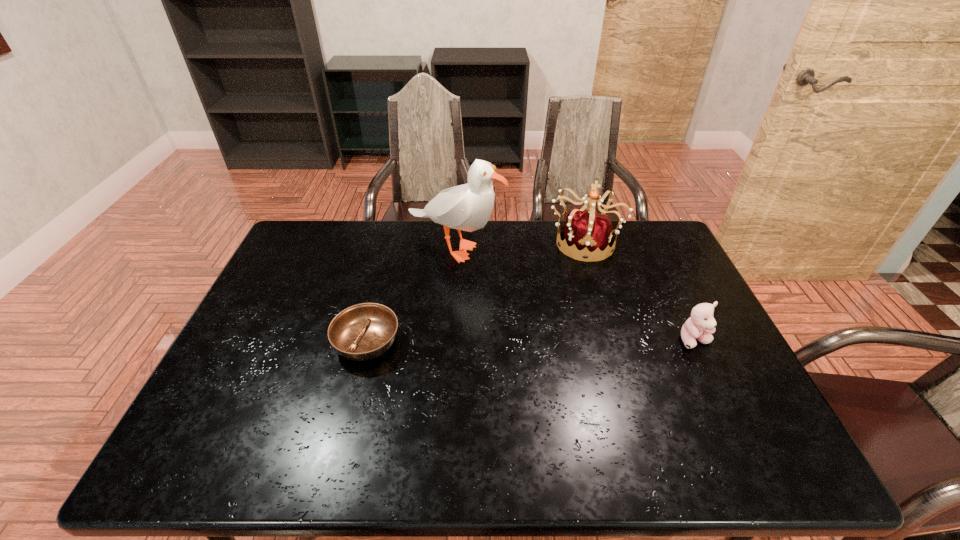
At what (x,y) coordinates should I click in order to perform the action: click on vacant space located at the beak of the tallest object. Please return your answer as a coordinate pair (x, y). Looking at the image, I should click on click(490, 289).

This screenshot has width=960, height=540. In order to click on blank area located 0.320m on the front-facing side of the third shortest object in this screenshot , I will do `click(574, 334)`.

This screenshot has width=960, height=540. Identify the location of blank space located 0.400m on the front-facing side of the third shortest object. [572, 357].

Where is `free location located on the front-facing side of the third shortest object`? The height and width of the screenshot is (540, 960). free location located on the front-facing side of the third shortest object is located at coordinates (574, 334).

Locate an element on the screen. gull at the far edge is located at coordinates (467, 207).

Find the location of a particular element. Image resolution: width=960 pixels, height=540 pixels. tiara that is at the far edge is located at coordinates (585, 229).

This screenshot has width=960, height=540. What are the coordinates of `object that is at the right edge` in the screenshot? It's located at (701, 324).

The image size is (960, 540). I want to click on free spot at the far edge of the desktop, so (x=472, y=250).

Identify the location of vacant region at the near edge. (601, 407).

You are a GUI agent. You are given a task and a screenshot of the screen. Output one action in this format:
    pyautogui.click(x=<x>, y=<y>)
    Task: Click on the vacant point at the right edge
    The height and width of the screenshot is (540, 960).
    Given the screenshot: What is the action you would take?
    pyautogui.click(x=703, y=382)